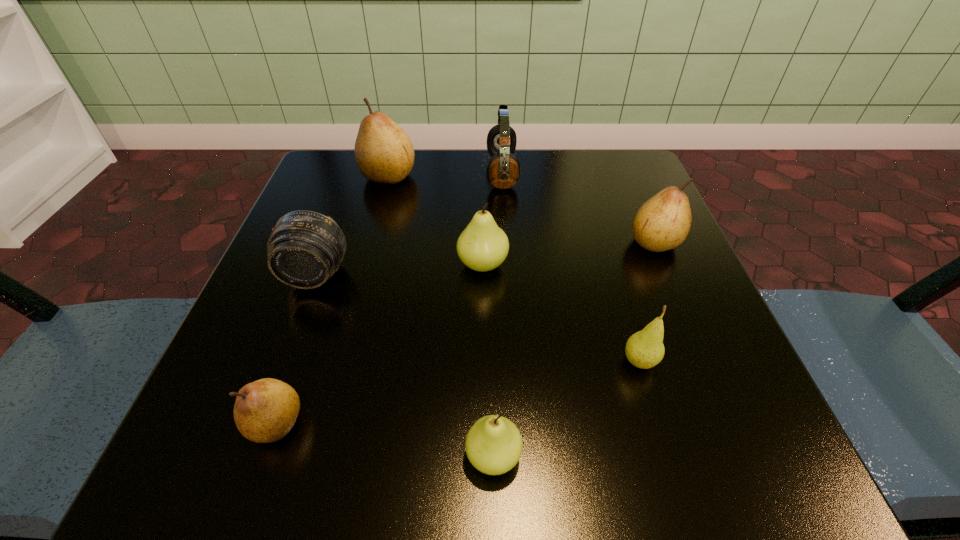
You are a GUI agent. You are given a task and a screenshot of the screen. Output one action in this format:
    pyautogui.click(x=<x>, y=<y>)
    Task: Click on the vacant space situated on the right of the smaller green pear
    
    Given the screenshot: What is the action you would take?
    pyautogui.click(x=685, y=456)

Locate an element on the screen. The height and width of the screenshot is (540, 960). pear that is at the far edge is located at coordinates (384, 153).

Locate an element on the screen. Image resolution: width=960 pixels, height=540 pixels. headset that is at the far edge is located at coordinates (503, 171).

In order to click on telephoto lens that is at the left edge in this screenshot , I will do `click(305, 248)`.

Locate an element on the screen. The height and width of the screenshot is (540, 960). object that is at the far left corner is located at coordinates (384, 153).

This screenshot has height=540, width=960. Identify the location of object located at the near left corner. (265, 410).

I want to click on vacant space at the far edge of the desktop, so click(482, 185).

In the image, there is a desktop. Identify the location of blank space at the near edge. (428, 415).

You are a GUI agent. You are given a task and a screenshot of the screen. Output one action in this format:
    pyautogui.click(x=<x>, y=<y>)
    Task: Click on the vacant space at the left edge of the desktop
    This screenshot has height=540, width=960.
    Given the screenshot: What is the action you would take?
    pyautogui.click(x=306, y=324)

Where is `free space at the right edge`? The width and height of the screenshot is (960, 540). free space at the right edge is located at coordinates (728, 404).